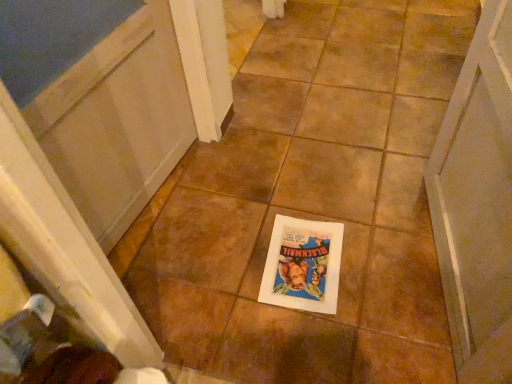
The height and width of the screenshot is (384, 512). What do you see at coordinates (303, 265) in the screenshot?
I see `matte paper book at center` at bounding box center [303, 265].

This screenshot has width=512, height=384. Identify the location of matte paper book at center. (303, 265).

Measure the distance between matte paper book at center and camera.

matte paper book at center and camera are 1.13 meters apart.

This screenshot has height=384, width=512. Identify the location of matte paper book at center. (303, 265).